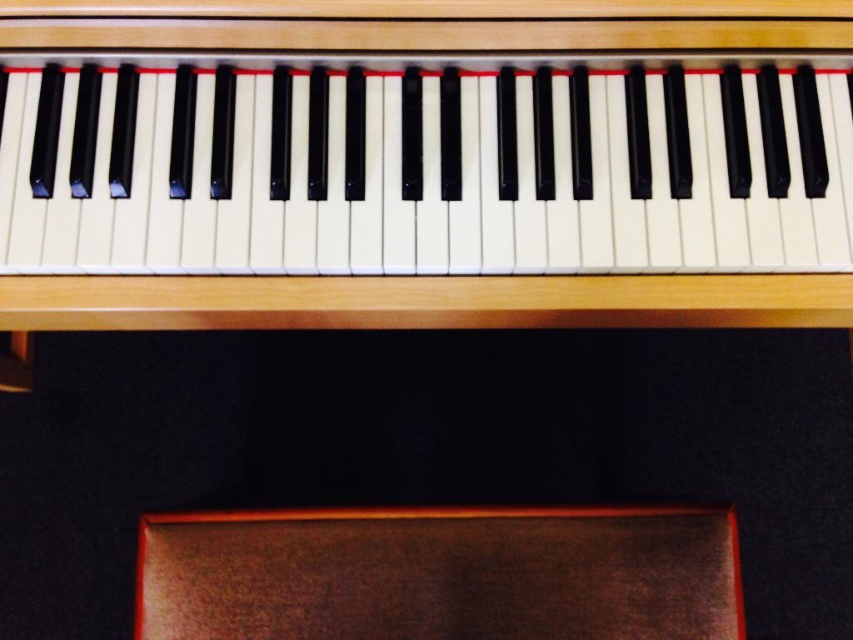
Question: Considering the relative positions of matte black piano keys at upper center and brown leather stool at lower center in the image provided, where is matte black piano keys at upper center located with respect to brown leather stool at lower center?

Choices:
 (A) below
 (B) above

Answer: (B)

Question: Among these objects, which one is nearest to the camera?

Choices:
 (A) brown leather stool at lower center
 (B) matte black piano keys at upper center

Answer: (B)

Question: Can you confirm if matte black piano keys at upper center is wider than brown leather stool at lower center?

Choices:
 (A) no
 (B) yes

Answer: (B)

Question: Does matte black piano keys at upper center have a lesser width compared to brown leather stool at lower center?

Choices:
 (A) no
 (B) yes

Answer: (A)